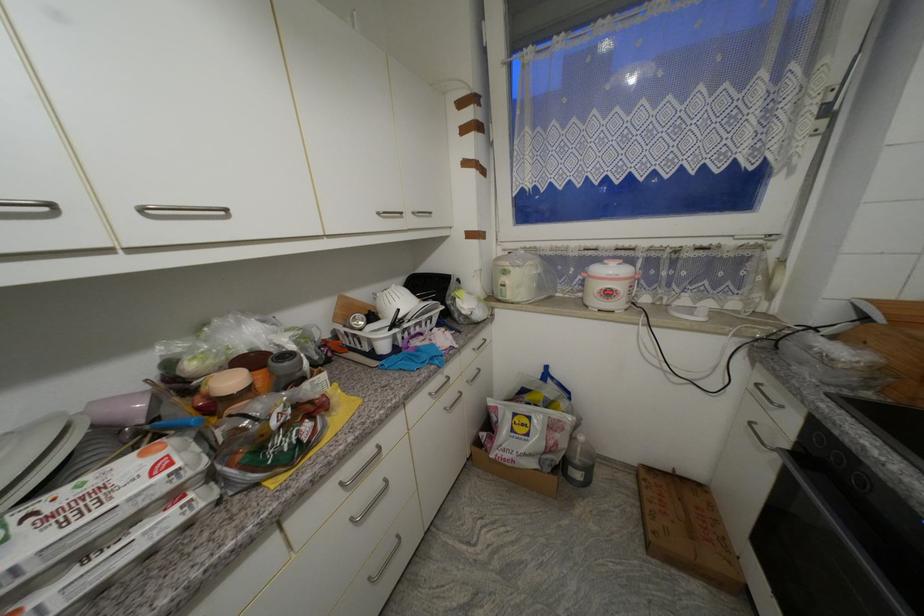
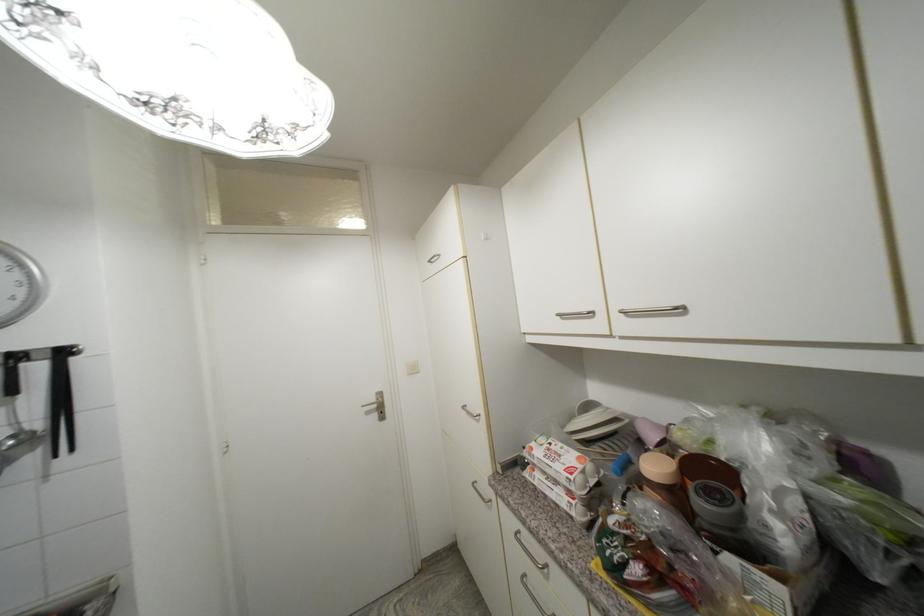
Where in the second image is the point corresponding to the point at 223,323 from the first image?

(730, 410)